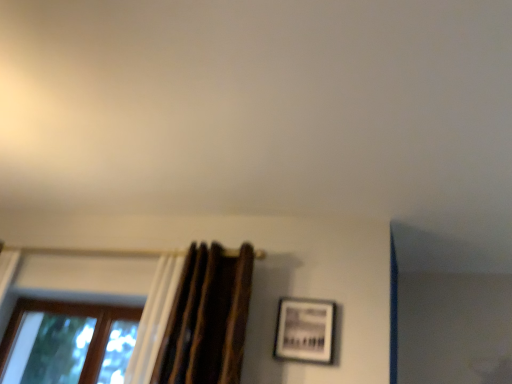
Question: From the image's perspective, would you say brown textured curtain at left is shown under brown wooden window at lower left?

Choices:
 (A) no
 (B) yes

Answer: (A)

Question: Are brown textured curtain at left and brown wooden window at lower left beside each other?

Choices:
 (A) no
 (B) yes

Answer: (A)

Question: Is the depth of brown textured curtain at left greater than that of brown wooden window at lower left?

Choices:
 (A) no
 (B) yes

Answer: (A)

Question: From a real-world perspective, is brown textured curtain at left located beneath brown wooden window at lower left?

Choices:
 (A) yes
 (B) no

Answer: (B)

Question: Is brown textured curtain at left bigger than brown wooden window at lower left?

Choices:
 (A) yes
 (B) no

Answer: (A)

Question: Is brown textured curtain at left shorter than brown wooden window at lower left?

Choices:
 (A) yes
 (B) no

Answer: (B)

Question: Can you confirm if brown textured curtain at left is bigger than matte black picture frame at center-right?

Choices:
 (A) no
 (B) yes

Answer: (B)

Question: Is brown textured curtain at left positioned beyond the bounds of matte black picture frame at center-right?

Choices:
 (A) no
 (B) yes

Answer: (B)

Question: Is brown textured curtain at left far from matte black picture frame at center-right?

Choices:
 (A) no
 (B) yes

Answer: (A)

Question: Is brown textured curtain at left at the left side of matte black picture frame at center-right?

Choices:
 (A) yes
 (B) no

Answer: (A)

Question: Is brown textured curtain at left positioned with its back to matte black picture frame at center-right?

Choices:
 (A) no
 (B) yes

Answer: (A)

Question: From the image's perspective, is brown textured curtain at left above matte black picture frame at center-right?

Choices:
 (A) yes
 (B) no

Answer: (A)

Question: From the image's perspective, is matte black picture frame at center-right above brown textured curtain at left?

Choices:
 (A) yes
 (B) no

Answer: (B)